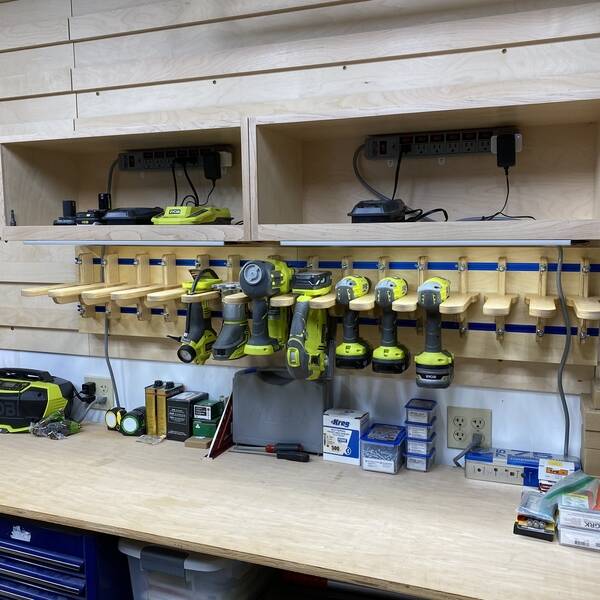
Where is `wood table`? wood table is located at coordinates (259, 538).